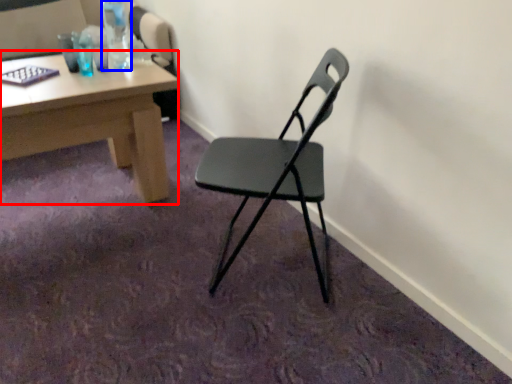
Question: Which object is closer to the camera taking this photo, desk (highlighted by a red box) or bottle (highlighted by a blue box)?

Choices:
 (A) desk
 (B) bottle

Answer: (B)